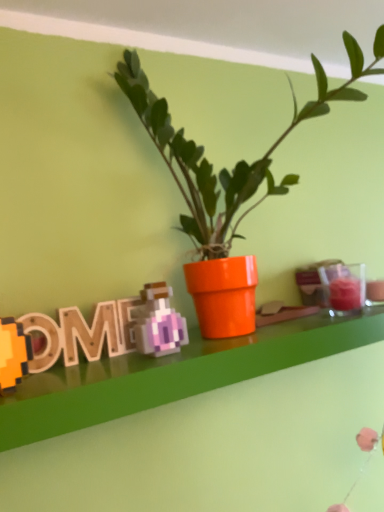
Question: Considering the positions of orange glossy pot at center and wooden pixelated letter at left in the image, is orange glossy pot at center taller or shorter than wooden pixelated letter at left?

Choices:
 (A) tall
 (B) short

Answer: (A)

Question: Based on their positions, is orange glossy pot at center located to the left or right of wooden pixelated letter at left?

Choices:
 (A) left
 (B) right

Answer: (B)

Question: Looking at the image, does orange glossy pot at center seem bigger or smaller compared to wooden pixelated letter at left?

Choices:
 (A) small
 (B) big

Answer: (B)

Question: Considering the relative positions of wooden pixelated letter at left and orange glossy pot at center in the image provided, is wooden pixelated letter at left to the left or to the right of orange glossy pot at center?

Choices:
 (A) left
 (B) right

Answer: (A)

Question: Looking at the image, does wooden pixelated letter at left seem bigger or smaller compared to orange glossy pot at center?

Choices:
 (A) small
 (B) big

Answer: (A)

Question: In the image, is wooden pixelated letter at left positioned in front of or behind orange glossy pot at center?

Choices:
 (A) behind
 (B) front

Answer: (A)

Question: From the image's perspective, is wooden pixelated letter at left located above or below orange glossy pot at center?

Choices:
 (A) below
 (B) above

Answer: (A)